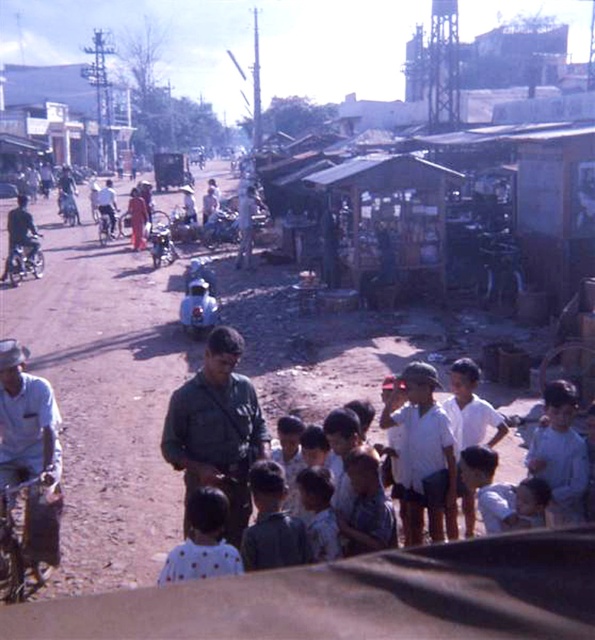
You are standing in the middle of the street and want to determine which of the two points, point [414,465] or point [42,259], is nearer to you. Based on the scene, which one is closer?

Point [414,465] is closer to the viewer than point [42,259], so it is the nearer one.

What is located at the coordinates point (105, 396) in the image?

The point (105, 396) indicates a brown dirt field at center.